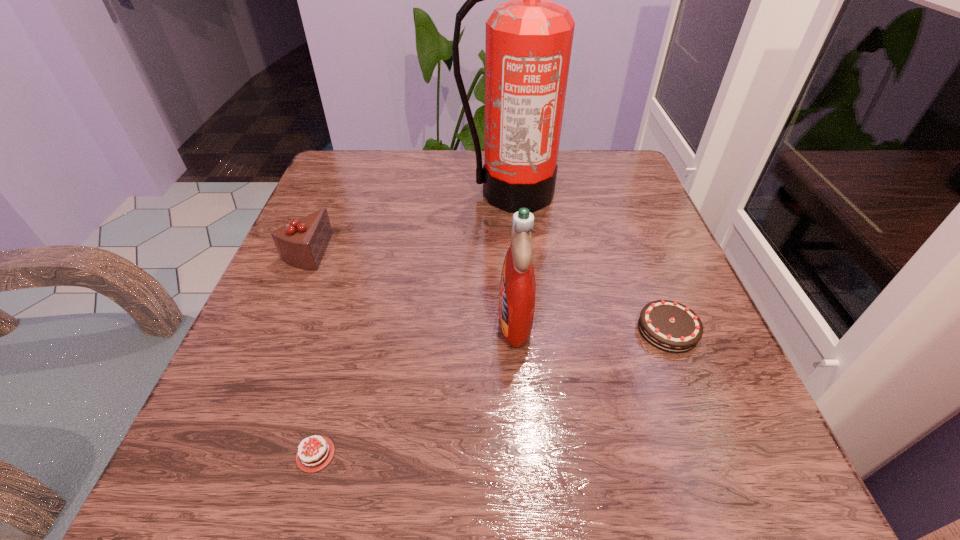
Where is `free spot between the rightmost chocolate cake and the second chocolate cake from left to right`? free spot between the rightmost chocolate cake and the second chocolate cake from left to right is located at coordinates (492, 392).

Locate an element on the screen. The height and width of the screenshot is (540, 960). empty location between the fourth nearest object and the detergent is located at coordinates coord(410,286).

Locate an element on the screen. This screenshot has width=960, height=540. vacant point located between the second farthest chocolate cake and the leftmost object is located at coordinates (487, 291).

The image size is (960, 540). I want to click on free space between the rightmost object and the tallest chocolate cake, so click(487, 291).

Image resolution: width=960 pixels, height=540 pixels. Identify the location of vacant space that is in between the leftmost object and the farthest object. (408, 222).

Locate an element on the screen. free space between the farthest object and the fourth object from right to left is located at coordinates (414, 323).

Image resolution: width=960 pixels, height=540 pixels. Find the location of `object identified as the fourth closest to the second shortest object`. object identified as the fourth closest to the second shortest object is located at coordinates (302, 243).

At what (x,y) coordinates should I click in order to perform the action: click on object that is the closest to the tallest object. Please return your answer as a coordinate pair (x, y). The height and width of the screenshot is (540, 960). Looking at the image, I should click on (517, 293).

This screenshot has width=960, height=540. Find the location of `the second closest chocolate cake to the fourth tallest object`. the second closest chocolate cake to the fourth tallest object is located at coordinates (302, 243).

You are a GUI agent. You are given a task and a screenshot of the screen. Output one action in this format:
    pyautogui.click(x=<x>, y=<y>)
    Task: Click on the chocolate cake that is the second closest to the second shortest object
    Image resolution: width=960 pixels, height=540 pixels.
    Given the screenshot: What is the action you would take?
    pyautogui.click(x=302, y=243)